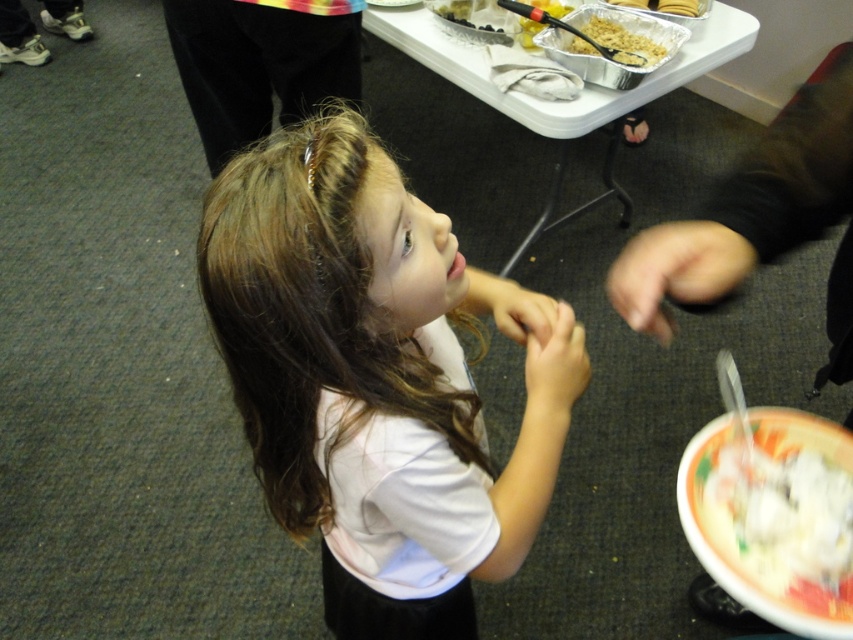
Based on the photo, is white creamy bowl at lower right above white plastic tray at upper center?

Actually, white creamy bowl at lower right is below white plastic tray at upper center.

Is point (840, 568) more distant than point (570, 104)?

No, it is in front of (570, 104).

Does point (714, 524) come closer to viewer compared to point (746, 17)?

Yes, it is in front of point (746, 17).

Find the location of a particular element. white creamy bowl at lower right is located at coordinates (775, 516).

Can you confirm if white matte shirt at center is thinner than metallic aluminum foil tray at upper center?

No.

Is white matte shirt at center bigger than metallic aluminum foil tray at upper center?

Yes, white matte shirt at center is bigger than metallic aluminum foil tray at upper center.

What do you see at coordinates (376, 378) in the screenshot? I see `white matte shirt at center` at bounding box center [376, 378].

You are a GUI agent. You are given a task and a screenshot of the screen. Output one action in this format:
    pyautogui.click(x=<x>, y=<y>)
    Task: Click on the white matte shirt at center
    The image size is (853, 640).
    Given the screenshot: What is the action you would take?
    pyautogui.click(x=376, y=378)

Does white matte shirt at center have a greater height compared to white plastic tray at upper center?

Yes.

Can you confirm if white matte shirt at center is positioned below white plastic tray at upper center?

Correct, white matte shirt at center is located below white plastic tray at upper center.

Is point (451, 307) behind point (376, 10)?

No.

Identify the location of white matte shirt at center. This screenshot has height=640, width=853. (376, 378).